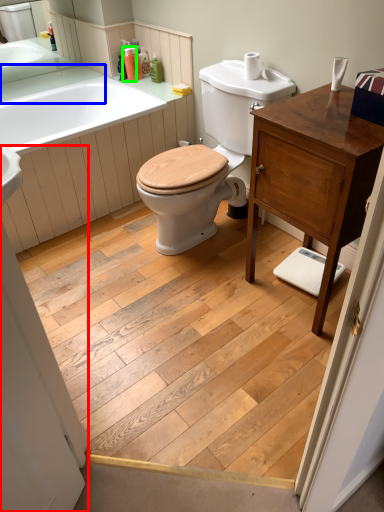
Question: Which object is positioned closest to screen door (highlighted by a red box)? Select from counter top (highlighted by a blue box) and toiletry (highlighted by a green box).

Choices:
 (A) counter top
 (B) toiletry

Answer: (A)